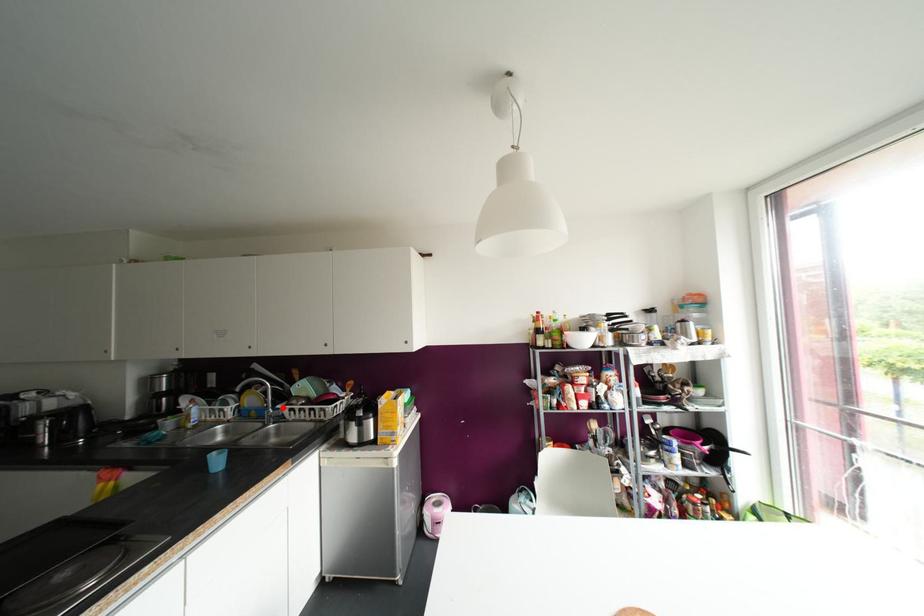
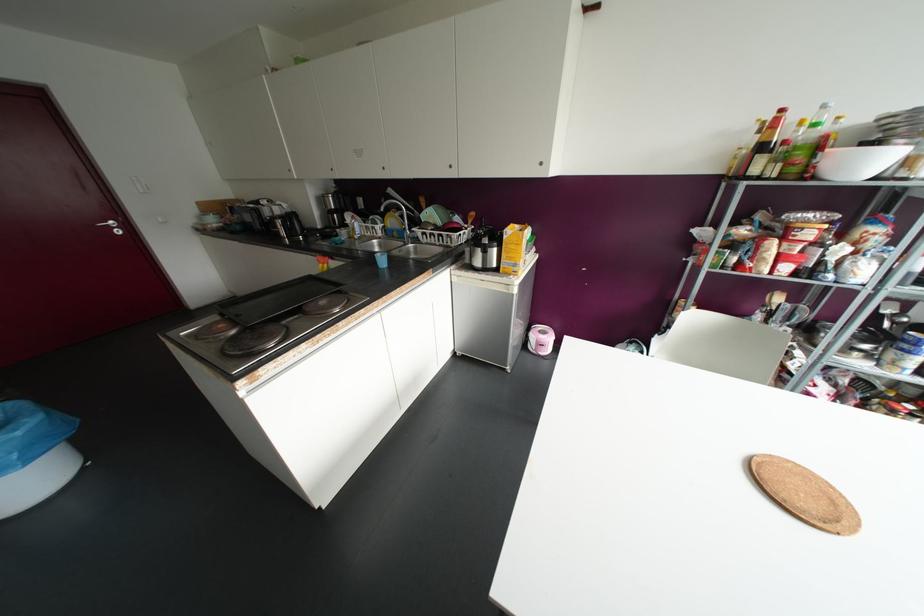
Where in the second image is the point corresponding to the highlighted location from the first image?

(417, 231)